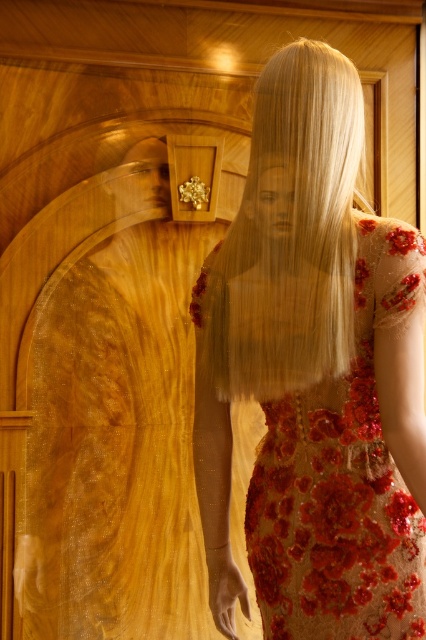
Consider the image. You are a fashion designer who wants to create a replica of the dress worn by the mannequin. You have a fabric sample that is the same size as the blonde silky hair at center. Do you think this fabric sample is sufficient to cover the sequined fabric dress at center?

The sequined fabric dress at center is bigger than blonde silky hair at center, so the fabric sample is not sufficient to cover the sequined fabric dress at center.

You are a fashion designer who needs to determine the spatial relationship between the sequined fabric dress at center and the blonde silky hair at center. Which object is wider?

The sequined fabric dress at center is wider than the blonde silky hair at center.

You are a tailor trying to fix a tear on the sequined fabric dress at center. You found a point at coordinates (314, 374). Is this point on the sequined fabric dress at center?

Yes, the point at coordinates (314, 374) is on the sequined fabric dress at center, as stated in the description.